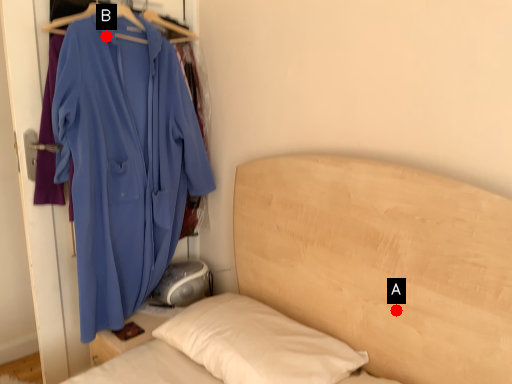
Question: Two points are circled on the image, labeled by A and B beside each circle. Which point is further to the camera?

Choices:
 (A) A is further
 (B) B is further

Answer: (B)